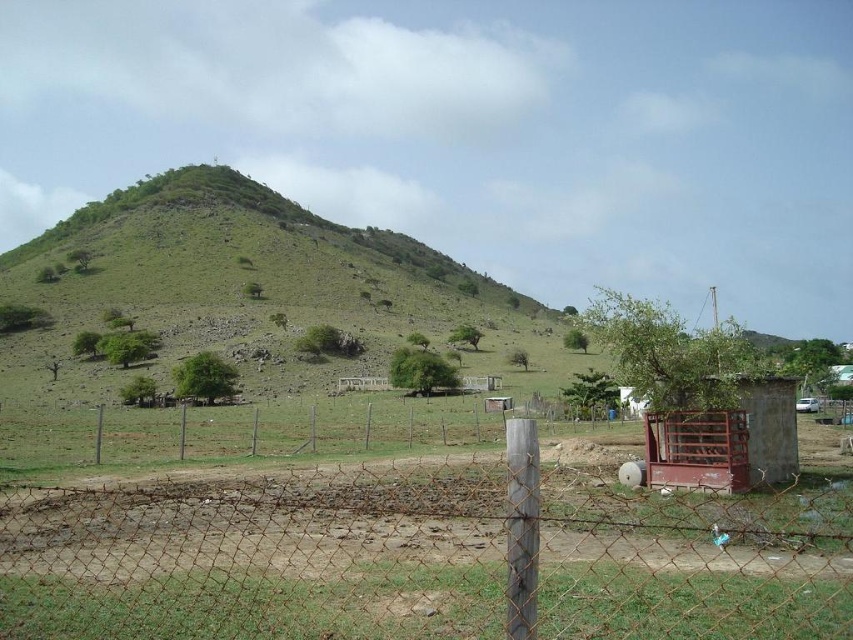
You are standing at the base of the grassy hill and looking towards the fenced area. There are two points marked in the image. Which point, point 1 at coordinates (647, 621) or point 2 at coordinates (177, 204), is closer to your current position?

Point 1 at coordinates (647, 621) is closer to your current position because it is closer to the camera than point 2 at coordinates (177, 204).

You are standing in the middle of the image and want to walk towards the green grassy hillside at upper center. Which direction should you move to avoid the rusty wire mesh fence at center?

Since the rusty wire mesh fence at center is closer to the viewer than the green grassy hillside at upper center, you should move to the right or left to go around the fence and reach the hillside.